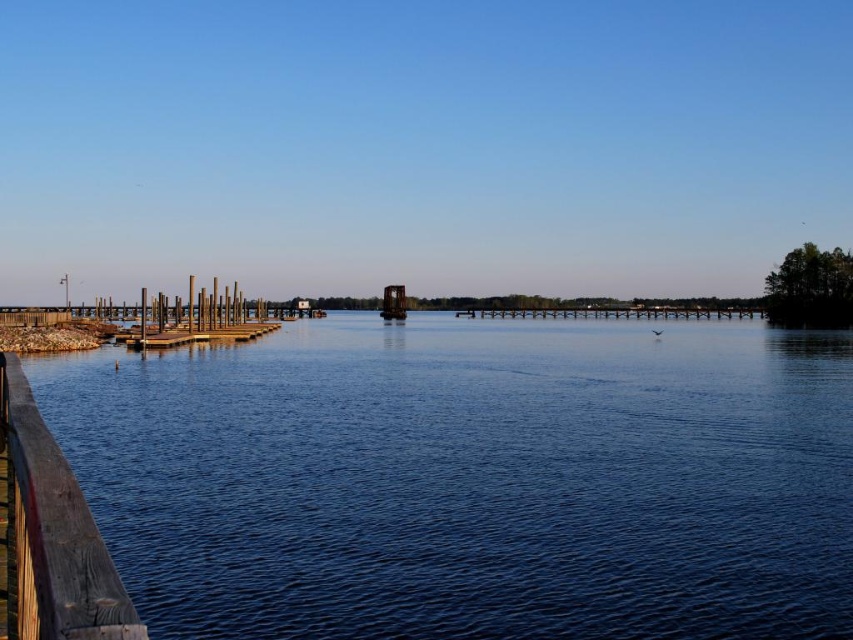
Question: Is blue water at lower left smaller than brown wooden rail at center?

Choices:
 (A) yes
 (B) no

Answer: (B)

Question: Where is brown wooden rail at center located in relation to rusty metal boat at center in the image?

Choices:
 (A) below
 (B) above

Answer: (A)

Question: Can you confirm if wooden textured rail at lower left is thinner than brown wooden rail at center?

Choices:
 (A) no
 (B) yes

Answer: (B)

Question: Which of the following is the farthest from the observer?

Choices:
 (A) rusty metal boat at center
 (B) brown wooden rail at center

Answer: (B)

Question: Which object appears closest to the camera in this image?

Choices:
 (A) brown wooden rail at center
 (B) wooden textured rail at lower left
 (C) blue water at lower left
 (D) rusty metal boat at center

Answer: (B)

Question: Which point is closer to the camera?

Choices:
 (A) rusty metal boat at center
 (B) brown wooden rail at center
 (C) blue water at lower left
 (D) wooden textured rail at lower left

Answer: (D)